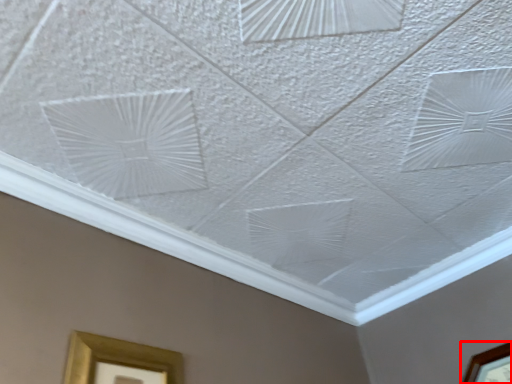
Question: From the image's perspective, what is the correct spatial positioning of picture frame (annotated by the red box) in reference to picture frame?

Choices:
 (A) above
 (B) below

Answer: (B)